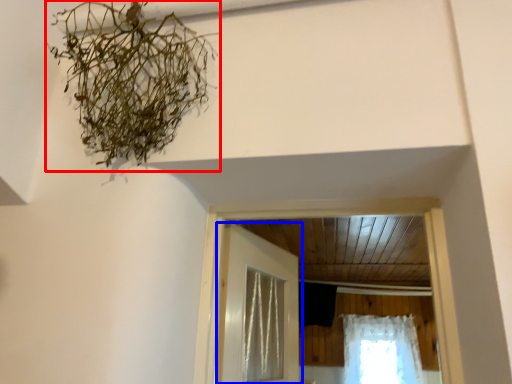
Question: Which of the following is the farthest to the observer, plant (highlighted by a red box) or door (highlighted by a blue box)?

Choices:
 (A) plant
 (B) door

Answer: (B)